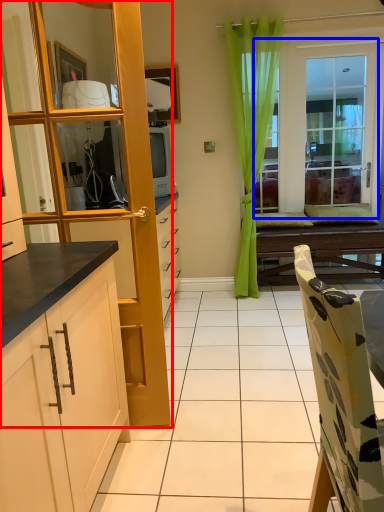
Question: Which point is closer to the camera, cabinetry (highlighted by a red box) or window (highlighted by a blue box)?

Choices:
 (A) cabinetry
 (B) window

Answer: (A)